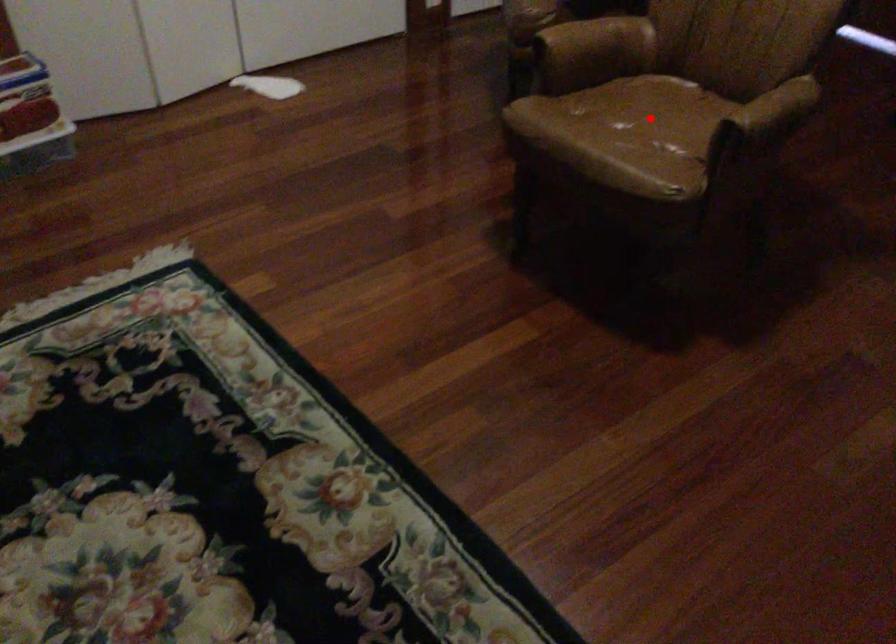
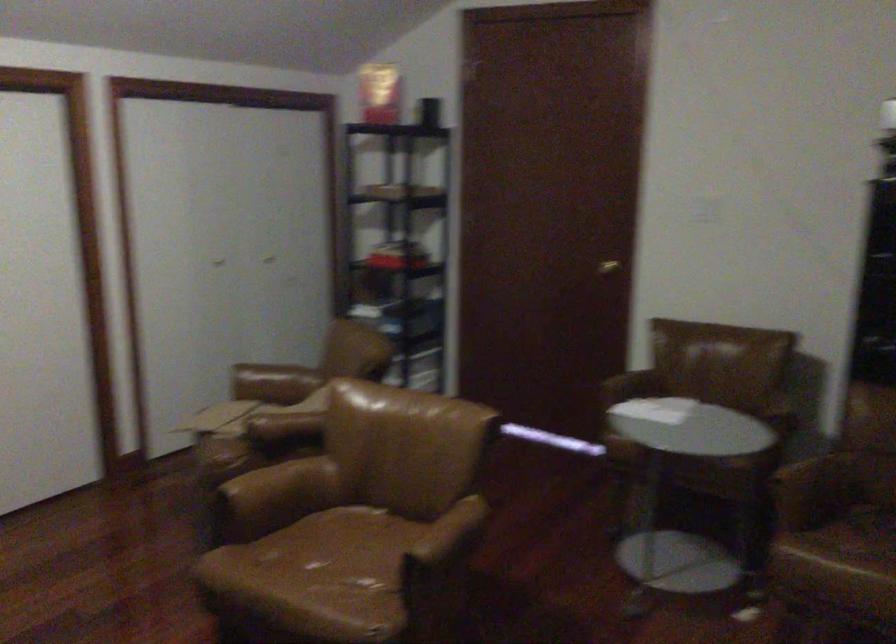
The point at the highlighted location is marked in the first image. Where is the corresponding point in the second image?

(343, 556)